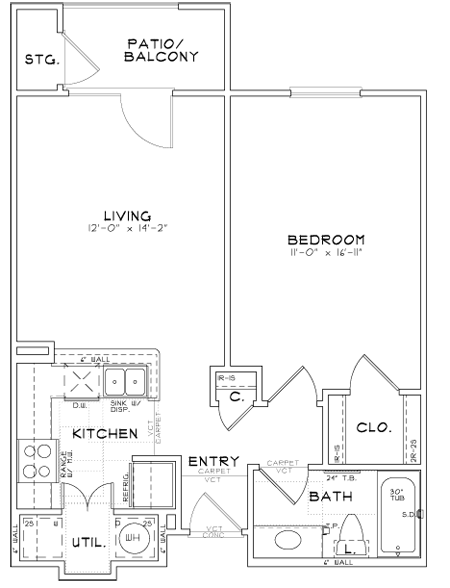
Locate an element on the screen. This screenshot has width=450, height=588. room you clean up in is located at coordinates (362, 503).